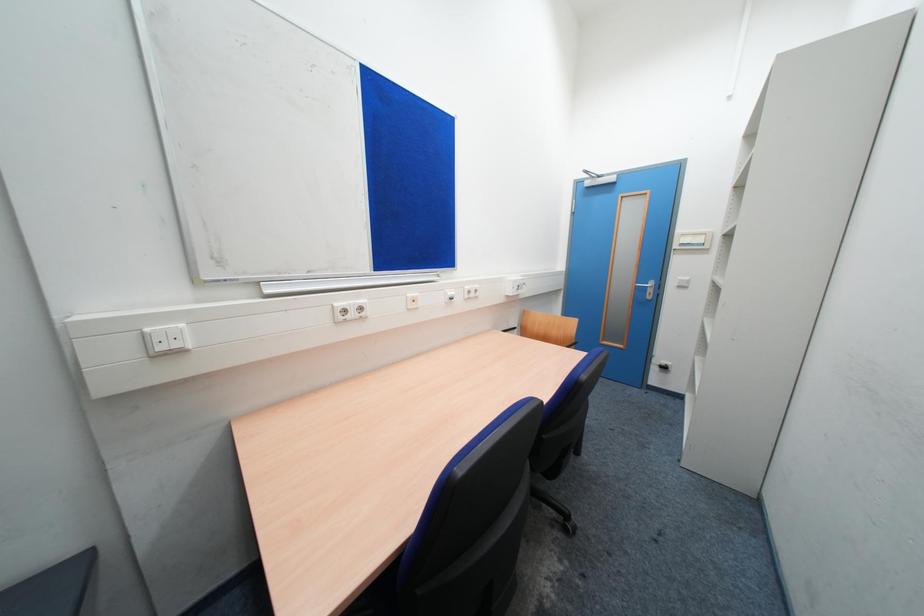
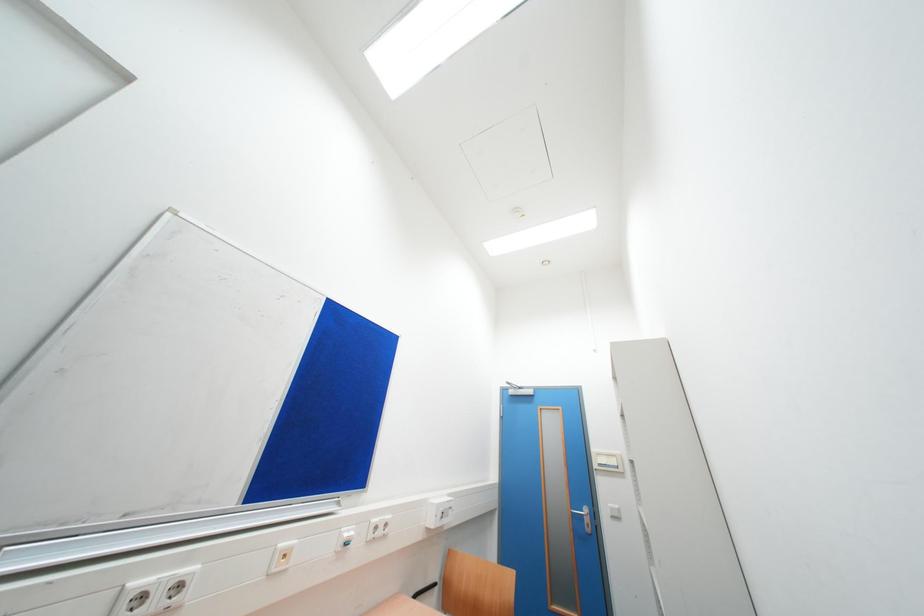
Question: The images are taken continuously from a first-person perspective. In which direction is your viewpoint rotating?

Choices:
 (A) Left
 (B) Right
 (C) Up
 (D) Down

Answer: (C)